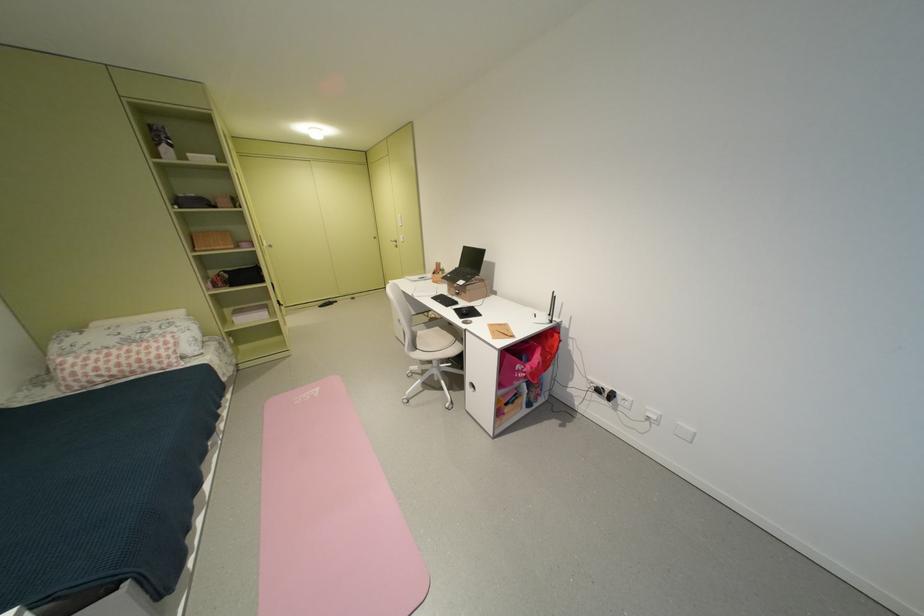
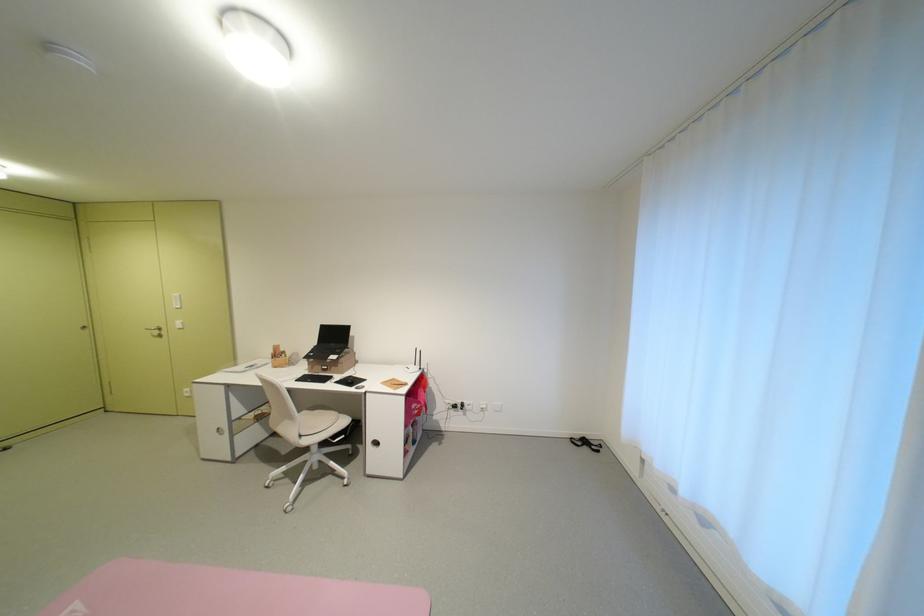
Find the pixel in the second image that matches pixel 456 307 in the first image.

(334, 383)